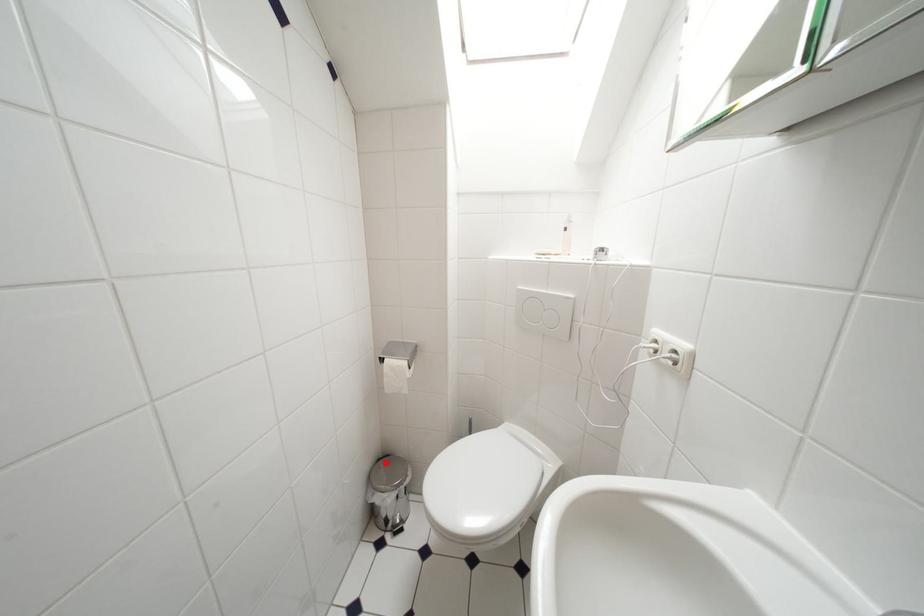
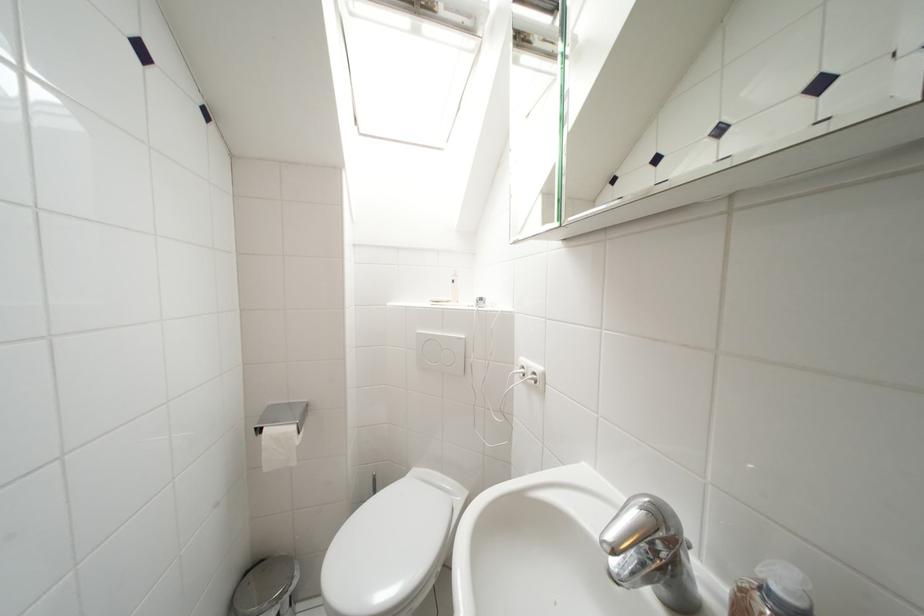
Where in the second image is the point corresponding to the highlighted location from the first image?

(253, 577)